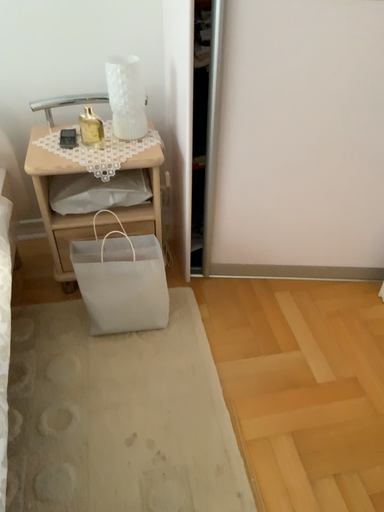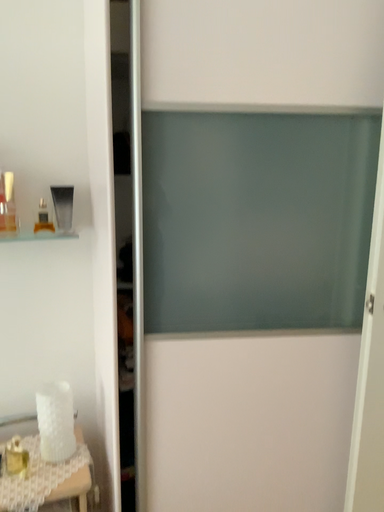
Question: How did the camera likely rotate when shooting the video?

Choices:
 (A) rotated downward
 (B) rotated upward

Answer: (B)